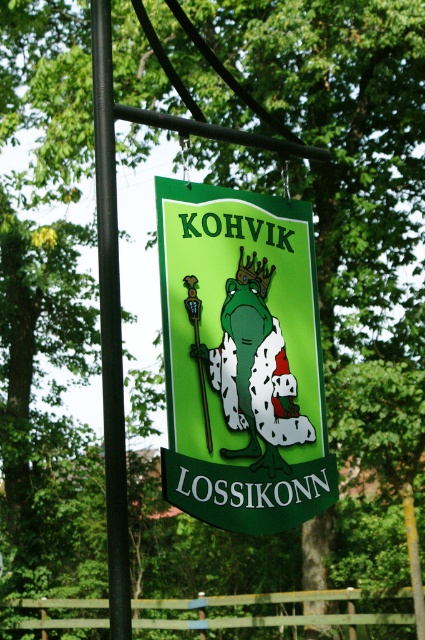
Question: Does green matte sign at center appear over black metal pole at left?

Choices:
 (A) no
 (B) yes

Answer: (A)

Question: Can you confirm if green matte sign at center is smaller than black metal pole at left?

Choices:
 (A) no
 (B) yes

Answer: (A)

Question: Which object is farther from the camera taking this photo?

Choices:
 (A) black metal pole at left
 (B) green matte sign at center

Answer: (B)

Question: Which point is farther from the camera taking this photo?

Choices:
 (A) (210, 390)
 (B) (112, 371)

Answer: (A)

Question: Is green matte sign at center wider than black metal pole at left?

Choices:
 (A) yes
 (B) no

Answer: (A)